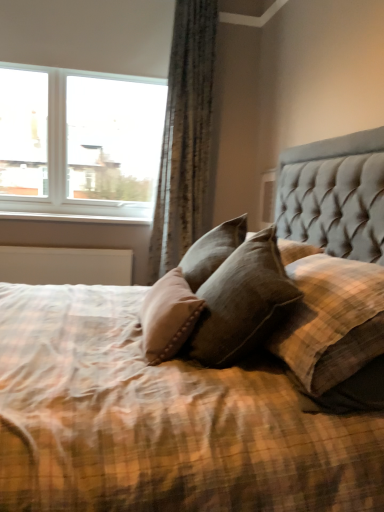
Question: Is textured gray curtain at upper left bigger or smaller than white glass window at upper left?

Choices:
 (A) big
 (B) small

Answer: (B)

Question: Would you say textured gray curtain at upper left is inside or outside white glass window at upper left?

Choices:
 (A) inside
 (B) outside

Answer: (B)

Question: Estimate the real-world distances between objects in this image. Which object is closer to the white glass window at upper left?

Choices:
 (A) brown textured pillow at center
 (B) textured gray curtain at upper left

Answer: (B)

Question: Based on their relative distances, which object is farther from the brown textured pillow at center?

Choices:
 (A) white glass window at upper left
 (B) textured gray curtain at upper left

Answer: (A)